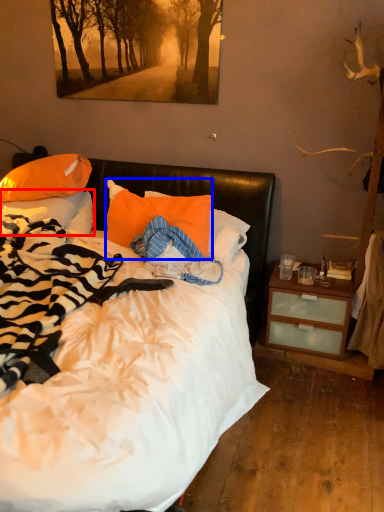
Question: Among these objects, which one is nearest to the camera, pillow (highlighted by a red box) or pillow (highlighted by a blue box)?

Choices:
 (A) pillow
 (B) pillow

Answer: (B)